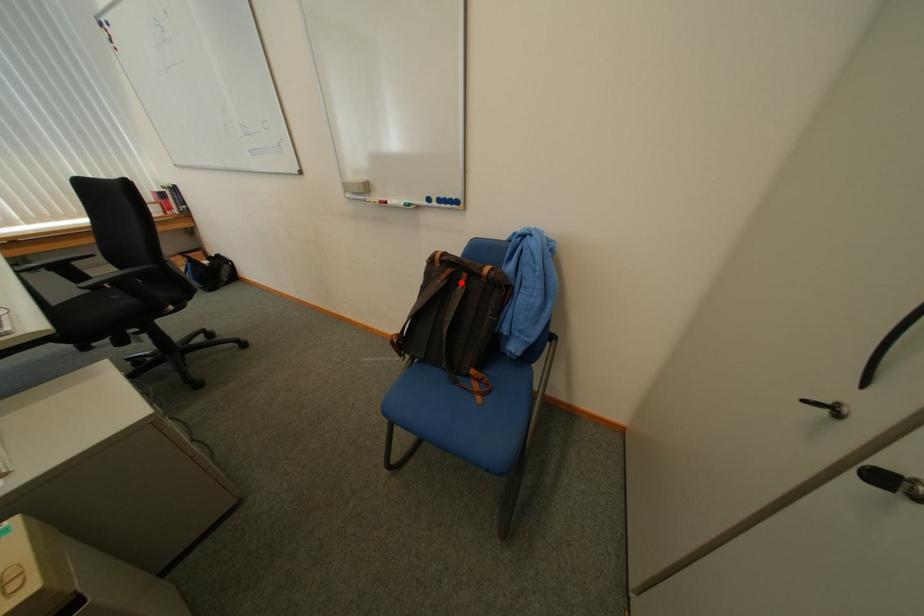
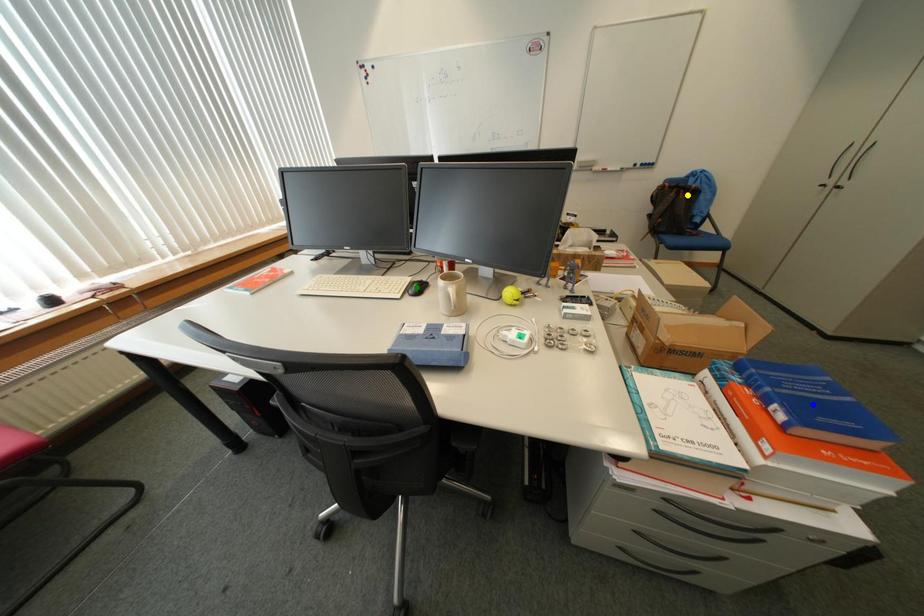
Question: I am providing you with two images of the same scene from different viewpoints. A red point is marked on the first image. You are given multiple points on the second image. Which spot in image 2 lines up with the point in image 1?

Choices:
 (A) blue point
 (B) green point
 (C) yellow point

Answer: (C)